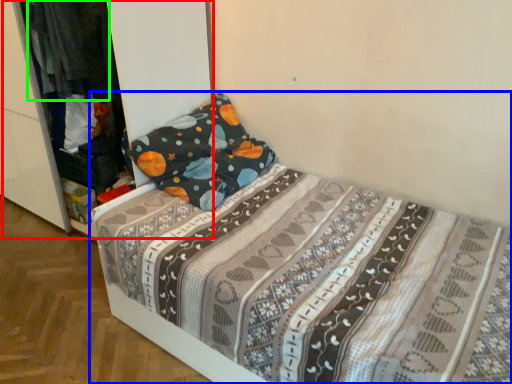
Question: Estimate the real-world distances between objects in this image. Which object is closer to dresser (highlighted by a red box), bed (highlighted by a blue box) or clothing (highlighted by a green box)?

Choices:
 (A) bed
 (B) clothing

Answer: (B)